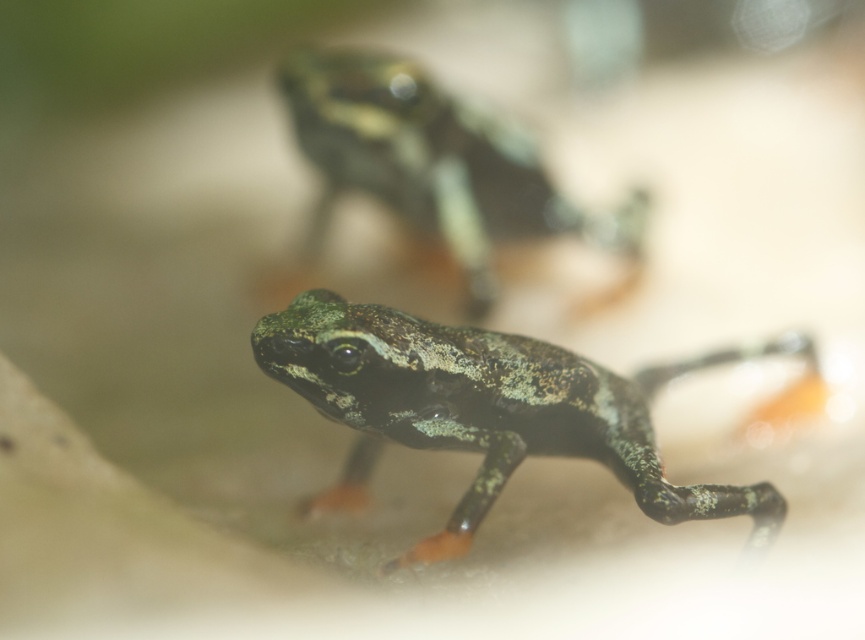
Question: Which point appears farthest from the camera in this image?

Choices:
 (A) (293, 346)
 (B) (526, 172)

Answer: (B)

Question: Is speckled green frog at center bigger than speckled green skin at center?

Choices:
 (A) yes
 (B) no

Answer: (A)

Question: Which of the following is the farthest from the observer?

Choices:
 (A) (407, 74)
 (B) (299, 349)

Answer: (A)

Question: Can you confirm if speckled green frog at center is bigger than speckled green skin at center?

Choices:
 (A) no
 (B) yes

Answer: (B)

Question: Is speckled green frog at center wider than speckled green skin at center?

Choices:
 (A) no
 (B) yes

Answer: (B)